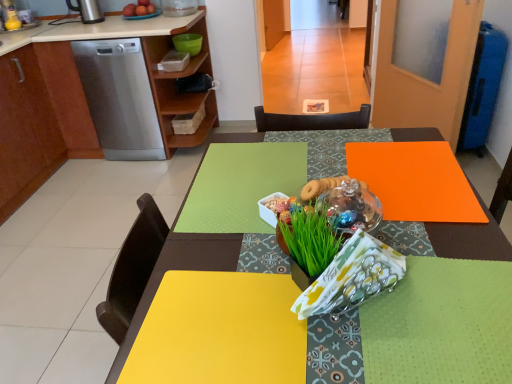
Where is `vacant point to the left of green leafy grass at center`? vacant point to the left of green leafy grass at center is located at coordinates (232, 257).